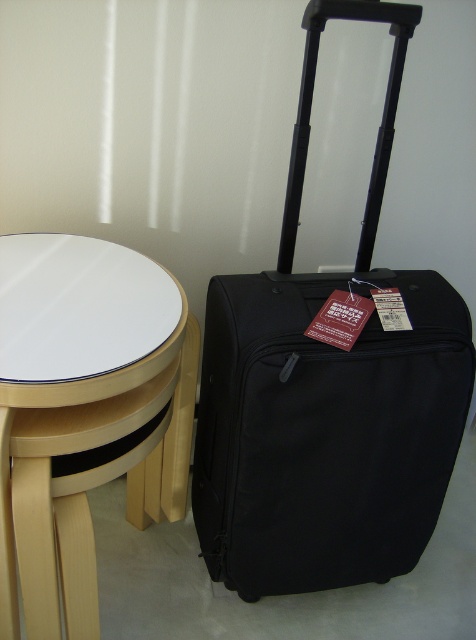
You are arranging furniture in a room and need to place a new sofa. You see the light wood side table at lower left and the white glossy table at center. Which table is positioned to the left of the other?

The light wood side table at lower left is to the left of the white glossy table at center.

You are standing in the room and want to reach the point marked at coordinates (118, 435). Given that your arm can extend 28 inches, can you reach that point without moving closer?

The distance between you and the point marked at coordinates (118, 435) is 32.92 inches. Since your arm can only extend 28 inches, you cannot reach that point without moving closer.

You are packing for a trip and need to place your black hardshell suitcase at right on top of the white glossy table at center. Based on their sizes, will the suitcase fit entirely on the table without hanging over the edges?

The black hardshell suitcase at right might be wider than white glossy table at center, so there is a possibility that it won not fit entirely on the table without hanging over the edges.